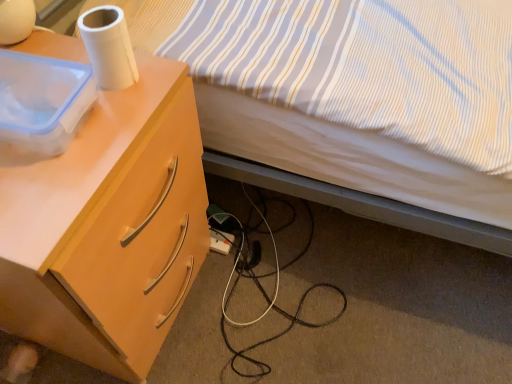
Question: From the image's perspective, does striped fabric bed at upper right appear lower than white plastic power outlet at lower center?

Choices:
 (A) yes
 (B) no

Answer: (B)

Question: Is striped fabric bed at upper right shorter than white plastic power outlet at lower center?

Choices:
 (A) yes
 (B) no

Answer: (B)

Question: Is striped fabric bed at upper right positioned far away from white plastic power outlet at lower center?

Choices:
 (A) no
 (B) yes

Answer: (A)

Question: Is striped fabric bed at upper right to the right of white plastic power outlet at lower center from the viewer's perspective?

Choices:
 (A) no
 (B) yes

Answer: (B)

Question: Can you confirm if striped fabric bed at upper right is wider than white plastic power outlet at lower center?

Choices:
 (A) no
 (B) yes

Answer: (B)

Question: Is transparent plastic container at upper left taller or shorter than light wood/finish desk at left?

Choices:
 (A) short
 (B) tall

Answer: (A)

Question: From the image's perspective, is transparent plastic container at upper left positioned above or below light wood/finish desk at left?

Choices:
 (A) above
 (B) below

Answer: (A)

Question: Is point (13, 82) closer or farther from the camera than point (13, 269)?

Choices:
 (A) farther
 (B) closer

Answer: (A)

Question: Considering the positions of transparent plastic container at upper left and light wood/finish desk at left in the image, is transparent plastic container at upper left wider or thinner than light wood/finish desk at left?

Choices:
 (A) thin
 (B) wide

Answer: (A)

Question: From a real-world perspective, is white matte paper towel at upper left physically located above or below transparent plastic container at upper left?

Choices:
 (A) above
 (B) below

Answer: (A)

Question: Would you say white matte paper towel at upper left is to the left or to the right of transparent plastic container at upper left in the picture?

Choices:
 (A) right
 (B) left

Answer: (A)

Question: Is white matte paper towel at upper left situated inside transparent plastic container at upper left or outside?

Choices:
 (A) outside
 (B) inside

Answer: (A)

Question: Considering their positions, is white matte paper towel at upper left located in front of or behind transparent plastic container at upper left?

Choices:
 (A) front
 (B) behind

Answer: (B)

Question: Considering the positions of white plastic power outlet at lower center and white matte paper towel at upper left in the image, is white plastic power outlet at lower center wider or thinner than white matte paper towel at upper left?

Choices:
 (A) wide
 (B) thin

Answer: (A)

Question: From the image's perspective, is white plastic power outlet at lower center positioned above or below white matte paper towel at upper left?

Choices:
 (A) above
 (B) below

Answer: (B)